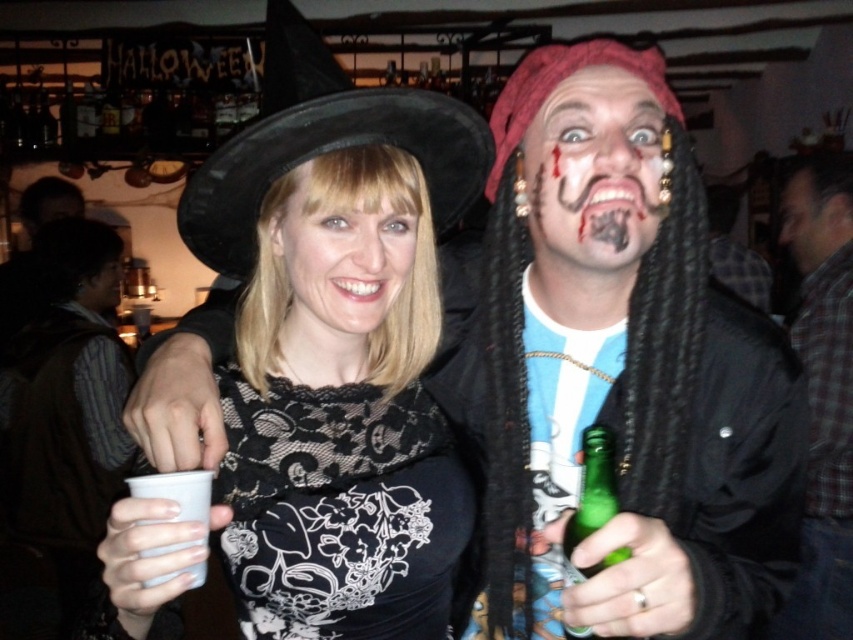
What is located at the coordinates point (340, 262) in the image?

The smooth skin face at center is located at point (340, 262).

You are a photographer at the Halloween party. You need to position the plaid shirt at right and the painted face at center so that both are visible in the photo. Given their height difference, where should you stand to ensure both are fully visible?

The plaid shirt at right is much taller than the painted face at center. To capture both fully, stand at a lower angle so that you can see the entirety of the painted face at center without the plaid shirt at right blocking it.

You are a photographer at a Halloween party. You want to take a photo of the smooth skin face at center and the green glass bottle at right. Based on their positions, which object is located to the left?

The smooth skin face at center is positioned on the left side of green glass bottle at right, so the smooth skin face at center is located to the left.